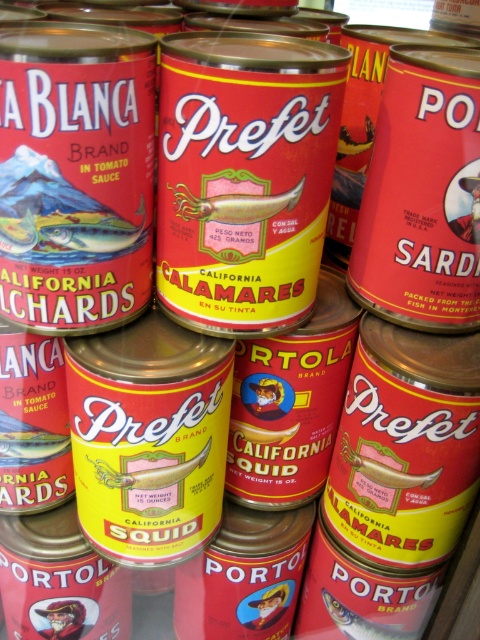
Is yellow matte squid at center to the left of shiny silver fish at center from the viewer's perspective?

Indeed, yellow matte squid at center is positioned on the left side of shiny silver fish at center.

Is point (245, 196) less distant than point (376, 627)?

Yes, point (245, 196) is closer to viewer.

Does point (249, 212) come closer to viewer compared to point (402, 632)?

Yes, it is.

Locate an element on the screen. This screenshot has height=640, width=480. yellow matte squid at center is located at coordinates (235, 204).